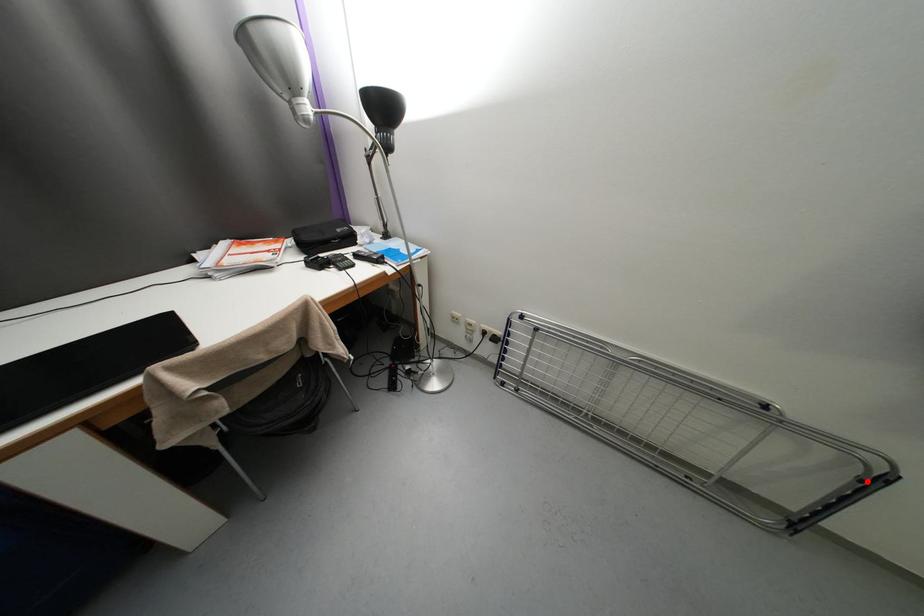
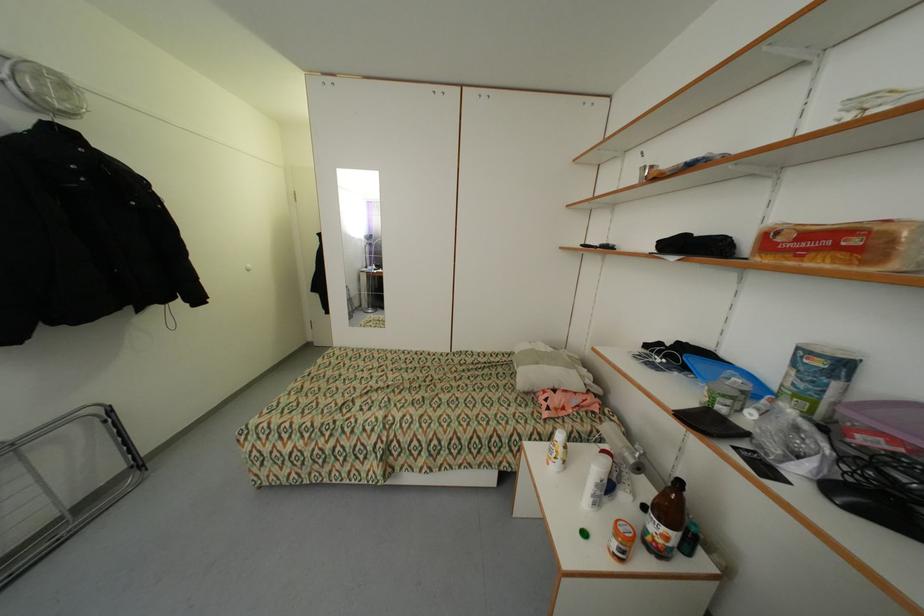
Find the pixel in the second image that matches the highlighted location in the first image.

(112, 422)